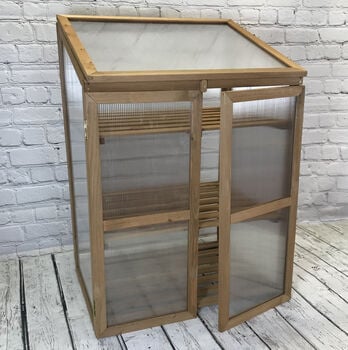
This screenshot has width=348, height=350. In order to click on left door in this screenshot , I will do `click(152, 222)`.